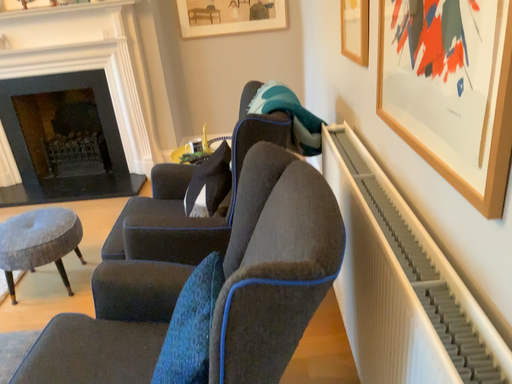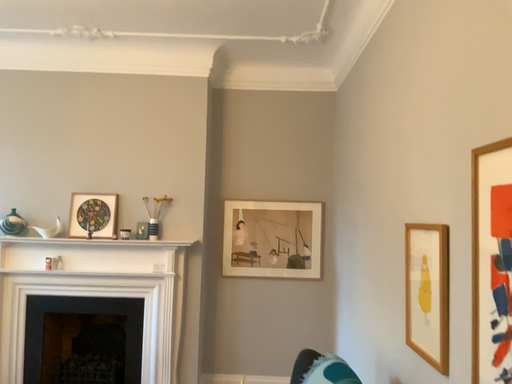
Question: Which way did the camera rotate in the video?

Choices:
 (A) rotated upward
 (B) rotated downward

Answer: (A)